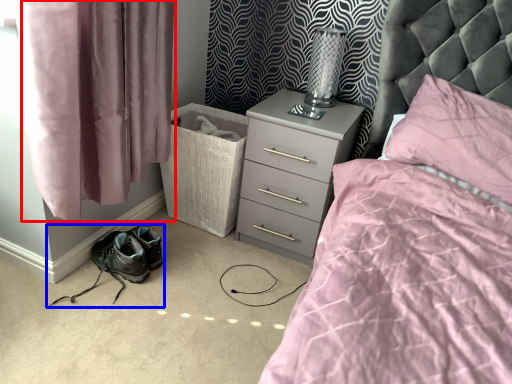
Question: Which of the following is the farthest to the observer, curtain (highlighted by a red box) or footwear (highlighted by a blue box)?

Choices:
 (A) curtain
 (B) footwear

Answer: (B)